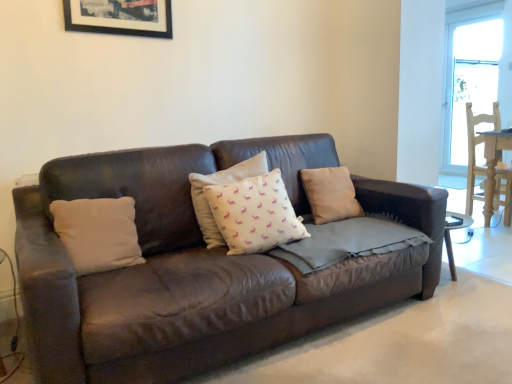
Question: From the image's perspective, is black matte picture frame at upper center above or below beige fabric pillow at center, the first pillow when ordered from right to left?

Choices:
 (A) below
 (B) above

Answer: (B)

Question: Do you think black matte picture frame at upper center is within beige fabric pillow at center, positioned as the 4th pillow in left-to-right order, or outside of it?

Choices:
 (A) inside
 (B) outside

Answer: (B)

Question: Which of these objects is positioned closest to the white cotton pillow at left, which ranks as the first pillow in left-to-right order?

Choices:
 (A) white fabric pillow with pink patterns at center, which is the third pillow from left to right
 (B) brown leather couch at center
 (C) black matte picture frame at upper center
 (D) white cotton cushion at center, the third pillow viewed from the right
 (E) beige fabric pillow at center, positioned as the 4th pillow in left-to-right order

Answer: (B)

Question: Which object is positioned farthest from the white fabric pillow with pink patterns at center, which is the second pillow in right-to-left order?

Choices:
 (A) beige fabric pillow at center, the first pillow when ordered from right to left
 (B) black matte picture frame at upper center
 (C) white cotton pillow at left, placed as the 4th pillow when sorted from right to left
 (D) white cotton cushion at center, the third pillow viewed from the right
 (E) brown leather couch at center

Answer: (B)